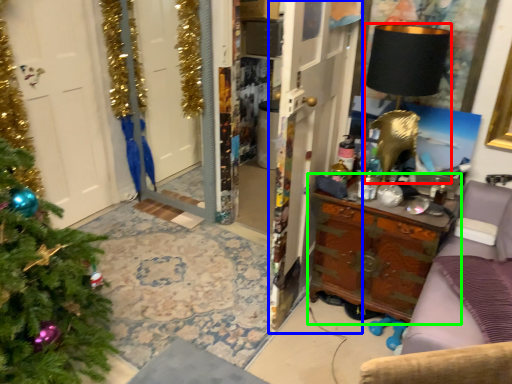
Question: Estimate the real-world distances between objects in this image. Which object is farther from lamp (highlighted by a red box), armoire (highlighted by a blue box) or table (highlighted by a green box)?

Choices:
 (A) armoire
 (B) table

Answer: (B)